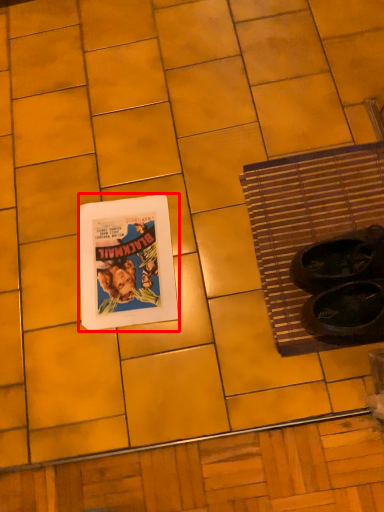
Question: From the image's perspective, what is the correct spatial positioning of picture frame (annotated by the red box) in reference to bath mat?

Choices:
 (A) above
 (B) below

Answer: (B)